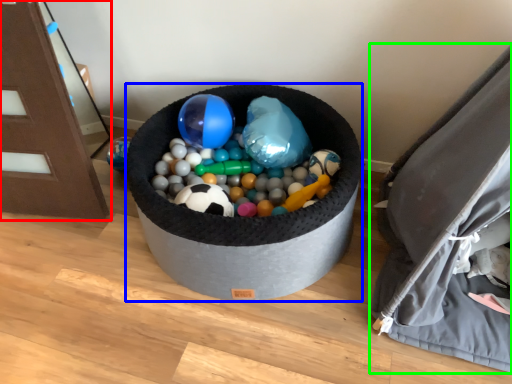
Question: Based on their relative distances, which object is nearer to furniture (highlighted by a red box)? Choose from toy (highlighted by a blue box) and bean bag chair (highlighted by a green box).

Choices:
 (A) toy
 (B) bean bag chair

Answer: (A)